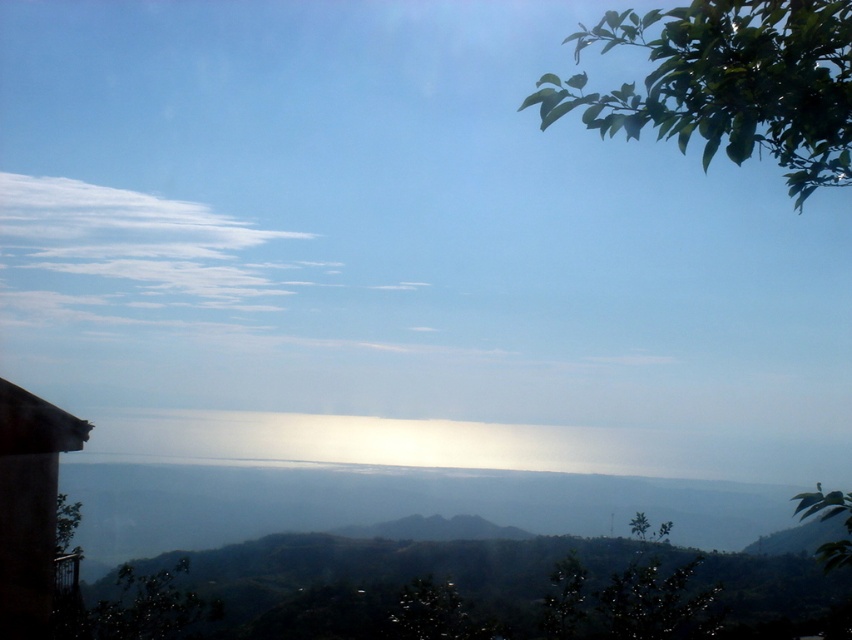
This screenshot has height=640, width=852. Describe the element at coordinates (29, 506) in the screenshot. I see `brown wooden hut at lower left` at that location.

Is brown wooden hut at lower left thinner than green leafy tree at lower left?

Yes, brown wooden hut at lower left is thinner than green leafy tree at lower left.

Is point (45, 579) positioned after point (159, 586)?

That is False.

The height and width of the screenshot is (640, 852). I want to click on brown wooden hut at lower left, so click(29, 506).

Can you confirm if green leafy tree at lower left is wider than green leafy tree at lower right?

Indeed, green leafy tree at lower left has a greater width compared to green leafy tree at lower right.

Is the position of green leafy tree at lower left less distant than that of green leafy tree at lower right?

No, green leafy tree at lower left is behind green leafy tree at lower right.

The width and height of the screenshot is (852, 640). Describe the element at coordinates (148, 605) in the screenshot. I see `green leafy tree at lower left` at that location.

The width and height of the screenshot is (852, 640). What are the coordinates of `green leafy tree at lower left` in the screenshot? It's located at (148, 605).

Is point (16, 392) farther from viewer compared to point (630, 518)?

Yes, it is.

What do you see at coordinates (29, 506) in the screenshot? Image resolution: width=852 pixels, height=640 pixels. I see `brown wooden hut at lower left` at bounding box center [29, 506].

This screenshot has width=852, height=640. What are the coordinates of `brown wooden hut at lower left` in the screenshot? It's located at (29, 506).